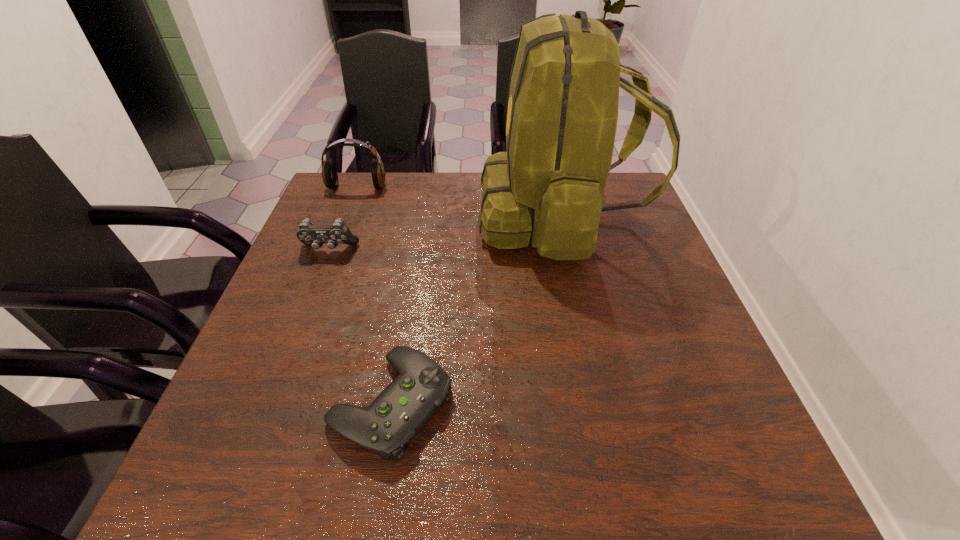
Find the location of a particular element. vacant space situated 0.060m on the ear cups of the third shortest object is located at coordinates (350, 206).

Where is `free region located on the surface of the left control with buttons`? Image resolution: width=960 pixels, height=540 pixels. free region located on the surface of the left control with buttons is located at coordinates (317, 282).

At what (x,y) coordinates should I click in order to perform the action: click on free spot located 0.140m on the right of the shorter control. Please return your answer as a coordinate pair (x, y). This screenshot has width=960, height=540. Looking at the image, I should click on 529,403.

The height and width of the screenshot is (540, 960). In order to click on backpack that is positioned at the far edge in this screenshot , I will do `click(562, 111)`.

Image resolution: width=960 pixels, height=540 pixels. I want to click on headset positioned at the far edge, so click(x=329, y=173).

Locate an element on the screen. object at the near edge is located at coordinates pos(399,413).

In order to click on headset located at the left edge in this screenshot , I will do `click(329, 173)`.

At what (x,y) coordinates should I click in order to perform the action: click on control situated at the left edge. Please return your answer as a coordinate pair (x, y). Image resolution: width=960 pixels, height=540 pixels. Looking at the image, I should click on (309, 234).

Where is `object that is positioned at the right edge`? The height and width of the screenshot is (540, 960). object that is positioned at the right edge is located at coordinates click(562, 111).

You are a GUI agent. You are given a task and a screenshot of the screen. Output one action in this format:
    pyautogui.click(x=<x>, y=<y>)
    Task: Click on the object at the far left corner
    
    Given the screenshot: What is the action you would take?
    pyautogui.click(x=329, y=173)